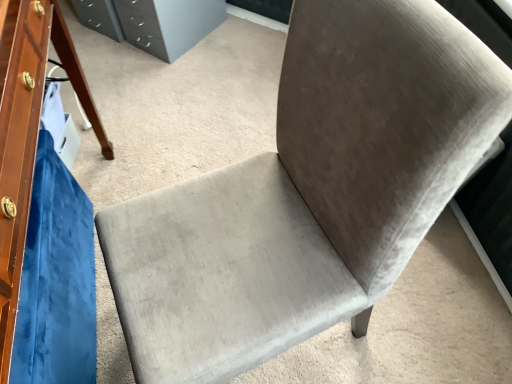
What do you see at coordinates (56, 280) in the screenshot? The height and width of the screenshot is (384, 512). I see `velvet blue fabric at left` at bounding box center [56, 280].

Looking at this image, what is the approximate width of velvet blue fabric at left?

The width of velvet blue fabric at left is 27.95 inches.

Identify the location of velvet blue fabric at left. Image resolution: width=512 pixels, height=384 pixels. (56, 280).

Where is `velvet blue fabric at left`? Image resolution: width=512 pixels, height=384 pixels. velvet blue fabric at left is located at coordinates (56, 280).